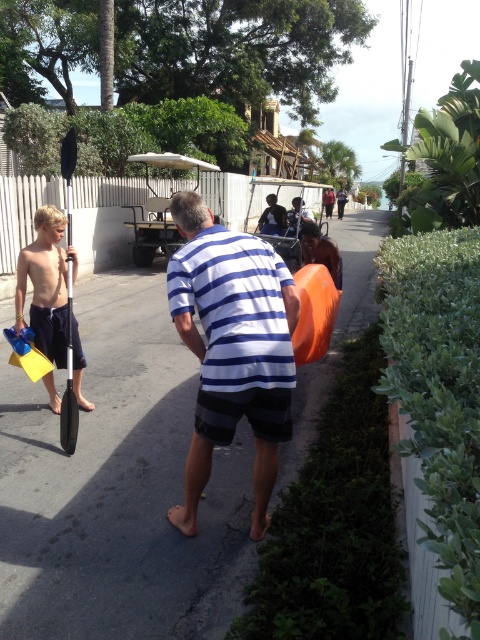
Question: Which point is closer to the camera?

Choices:
 (A) coord(197,253)
 (B) coord(40,209)
 (C) coord(154,317)

Answer: (A)

Question: Based on their relative distances, which object is nearer to the white striped shirt at center?

Choices:
 (A) yellow matte flippers at left
 (B) gray asphalt pavement at center

Answer: (A)

Question: Does white striped shirt at center come behind yellow matte flippers at left?

Choices:
 (A) yes
 (B) no

Answer: (B)

Question: Among these points, which one is nearest to the camera?

Choices:
 (A) (193, 268)
 (B) (145, 460)

Answer: (A)

Question: Can you confirm if white striped shirt at center is positioned to the right of yellow matte flippers at left?

Choices:
 (A) no
 (B) yes

Answer: (B)

Question: Can you confirm if white striped shirt at center is positioned above yellow matte flippers at left?

Choices:
 (A) no
 (B) yes

Answer: (A)